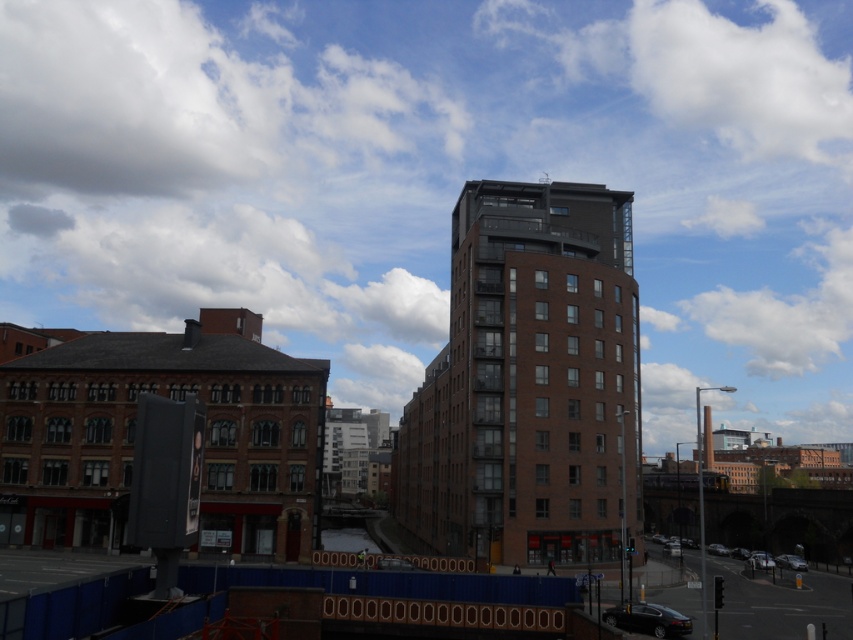
You are an architect planning to build a new skyscraper. You look at the image and see the white fluffy cloud at upper center and the brown brick building at center. Which object would cast a longer shadow during midday? Please explain your reasoning based on their sizes and positions.

The white fluffy cloud at upper center would cast a longer shadow than the brown brick building at center because it is larger in size. Since clouds are higher in the sky, their shadows can extend further on the ground compared to a building of similar size. However, in this case, the cloud is explicitly stated to be larger than the building, so its shadow would naturally be longer.

You are a drone operator trying to capture a photo of the white fluffy cloud at upper center. The camera has a 100mm lens with a field of view of 12 degrees. The cloud is located at coordinates 0.278, 0.515 in the image. Will the cloud fit entirely within the camera frame?

The cloud is located at coordinates [438,177] in the image. Since the camera has a 12 degree field of view, the cloud will fit entirely within the frame as long as its position is within the central area covered by the lens. Given the coordinates, it is likely centered enough to be fully captured.